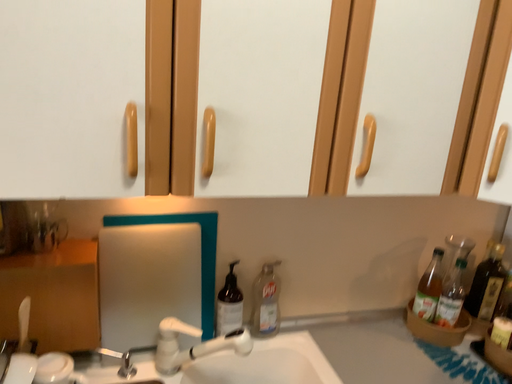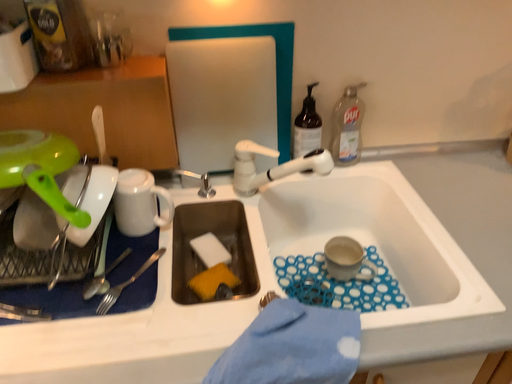
Question: Which way did the camera rotate in the video?

Choices:
 (A) rotated right
 (B) rotated left

Answer: (B)